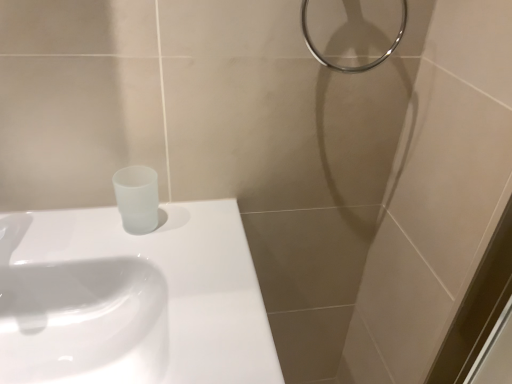
Question: Can you confirm if white glossy sink at lower left, positioned as the 2th sink in bottom-to-top order, is bigger than white glossy sink at upper left, acting as the 2th sink starting from the top?

Choices:
 (A) yes
 (B) no

Answer: (B)

Question: Is the depth of white glossy sink at lower left, positioned as the 2th sink in bottom-to-top order, less than that of white glossy sink at upper left, the 1th sink when ordered from bottom to top?

Choices:
 (A) no
 (B) yes

Answer: (B)

Question: From a real-world perspective, is white glossy sink at lower left, positioned as the 2th sink in bottom-to-top order, on white glossy sink at upper left, the 1th sink when ordered from bottom to top?

Choices:
 (A) no
 (B) yes

Answer: (B)

Question: Is white glossy sink at upper left, acting as the 2th sink starting from the top, located within white glossy sink at lower left, marked as the first sink in a top-to-bottom arrangement?

Choices:
 (A) no
 (B) yes

Answer: (A)

Question: Can you confirm if white glossy sink at lower left, positioned as the 2th sink in bottom-to-top order, is smaller than white glossy sink at upper left, the 1th sink when ordered from bottom to top?

Choices:
 (A) no
 (B) yes

Answer: (B)

Question: Can we say white glossy sink at lower left, marked as the first sink in a top-to-bottom arrangement, lies outside white glossy sink at upper left, acting as the 2th sink starting from the top?

Choices:
 (A) no
 (B) yes

Answer: (A)

Question: From a real-world perspective, is metallic ring at upper right under white glossy sink at lower left, marked as the first sink in a top-to-bottom arrangement?

Choices:
 (A) no
 (B) yes

Answer: (A)

Question: Would you say metallic ring at upper right contains white glossy sink at lower left, positioned as the 2th sink in bottom-to-top order?

Choices:
 (A) no
 (B) yes

Answer: (A)

Question: Is metallic ring at upper right far away from white glossy sink at lower left, positioned as the 2th sink in bottom-to-top order?

Choices:
 (A) no
 (B) yes

Answer: (A)

Question: Can you confirm if metallic ring at upper right is smaller than white glossy sink at lower left, positioned as the 2th sink in bottom-to-top order?

Choices:
 (A) yes
 (B) no

Answer: (A)

Question: Is metallic ring at upper right to the right of white glossy sink at lower left, marked as the first sink in a top-to-bottom arrangement, from the viewer's perspective?

Choices:
 (A) no
 (B) yes

Answer: (B)

Question: Is metallic ring at upper right positioned beyond the bounds of white glossy sink at lower left, positioned as the 2th sink in bottom-to-top order?

Choices:
 (A) no
 (B) yes

Answer: (B)

Question: From the image's perspective, is white glossy sink at lower left, positioned as the 2th sink in bottom-to-top order, located above metallic ring at upper right?

Choices:
 (A) yes
 (B) no

Answer: (B)